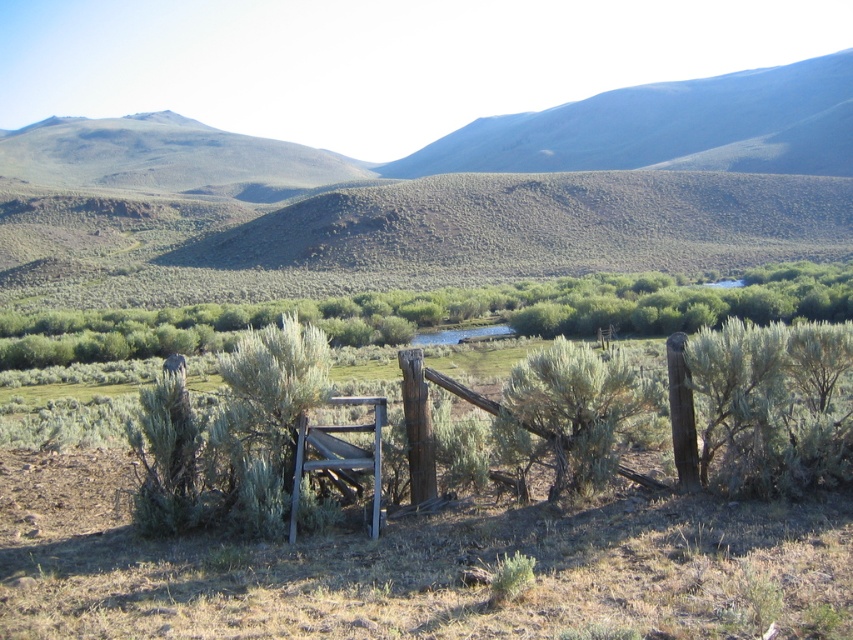
You are standing at the origin point of the image coordinate system. The origin is at the bottom left corner of the image. The x and y axes increase to the right and up respectively. You want to walk directly towards the green bushy shrub at center. In which direction should you move first?

Since the green bushy shrub at center is located at coordinates point (579, 412), you should move northeast first to reach it. Because the x coordinate is greater than 0.5 and the y coordinate is also greater than 0.5, moving northeast will align you towards the shrub.

Based on the photo, you are planning to place a new bench in the landscape scene. The bench is the same size as the wooden chair at center. Based on the current arrangement, will the bench fit in the space where the green bushy shrub at center is located?

The green bushy shrub at center is bigger than the wooden chair at center. Since the bench is the same size as the wooden chair at center, it might not fit in the space occupied by the larger shrub unless the shrub is removed or moved.